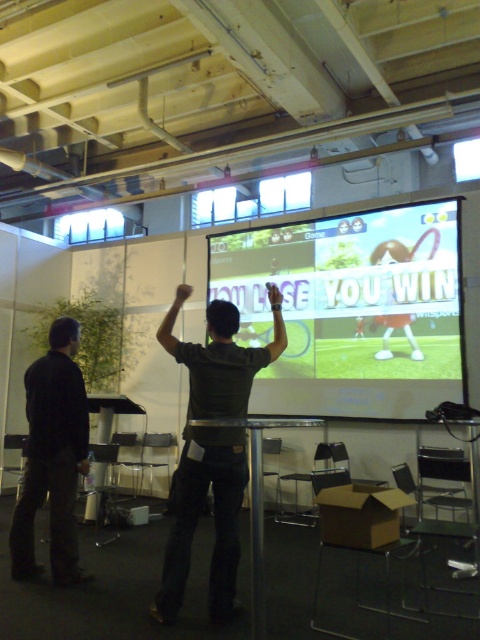
You are standing in the conference room and want to set up a camera for a video call. The camera has a field of view that can cover an area up to 1.5 meters wide. The matte green screen at center is located at point coordinates of (351, 308). If the camera is placed at the origin point, will the camera capture the entire matte green screen at center within its field of view?

The matte green screen at center is located at point coordinates of (351, 308). Since the camera is placed at the origin point, the distance from the camera to the screen can be calculated using the Pythagorean theorem. The distance would be sqrt. However, without knowing the actual scale of the coordinates, it is impossible to determine if the camera can capture the entire matte green screen within its field of view. Additional information about the coordinate system and scaling is required to provide an

You are a photographer setting up for a photoshoot in this room. You need to ensure that the dark green shirt at center is not visible in the background when photographing the matte green screen at center. Is this possible given their current positions?

The dark green shirt at center is behind the matte green screen at center, so it will be hidden from view when photographing the matte green screen at center, making it possible to avoid visibility.

You are a photographer planning to take a photo of the two people in the scene. The matte green screen at center is at point 0.484, 0.733. If you want to ensure the green screen is in the background of your photo, where should you position yourself relative to the people?

To ensure the matte green screen at center is in the background, you should position yourself behind the two people so that the green screen is behind them in the frame.